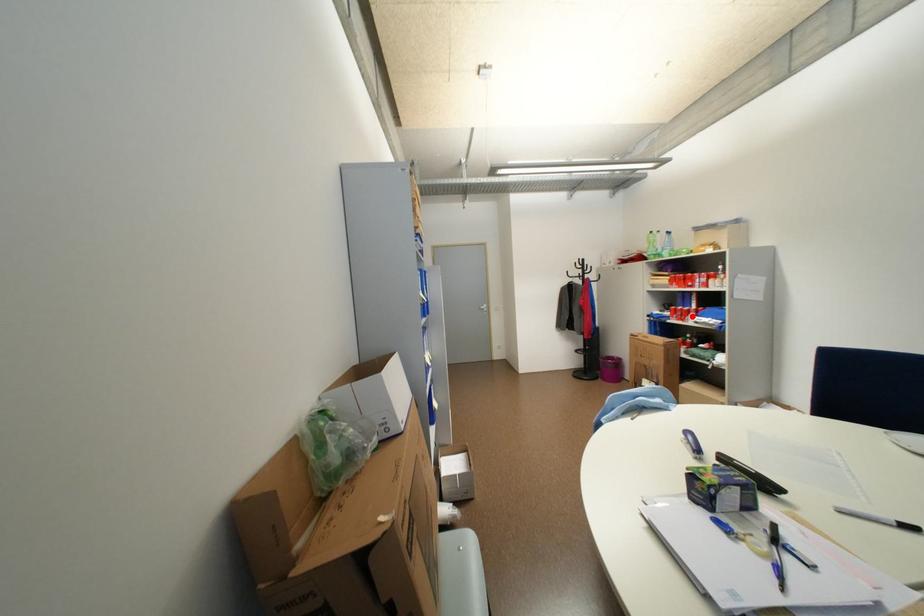
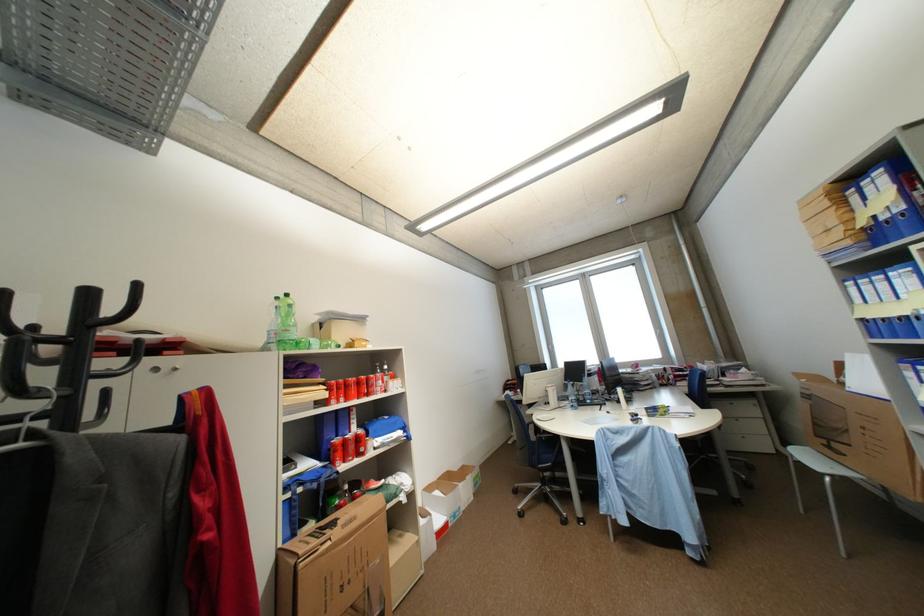
Locate, in the second image, the point that corresponds to the highlighted location in the first image.

(368, 447)